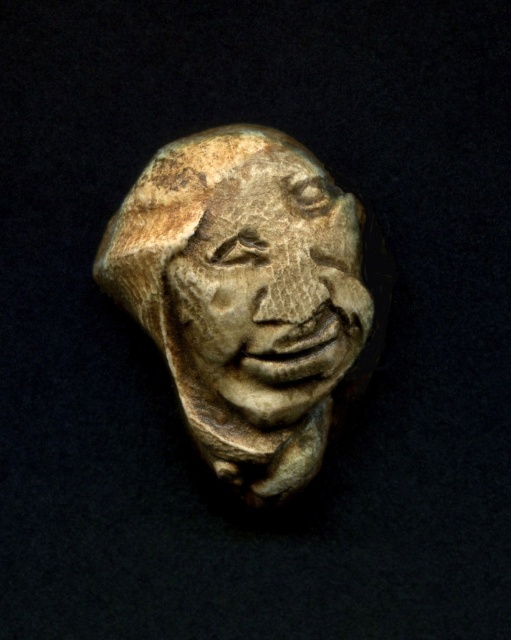
Between matte stone head at center and carved stone face at center, which one appears on the left side from the viewer's perspective?

matte stone head at center

What do you see at coordinates (251, 298) in the screenshot?
I see `matte stone head at center` at bounding box center [251, 298].

At what (x,y) coordinates should I click in order to perform the action: click on matte stone head at center. Please return your answer as a coordinate pair (x, y). Looking at the image, I should click on (251, 298).